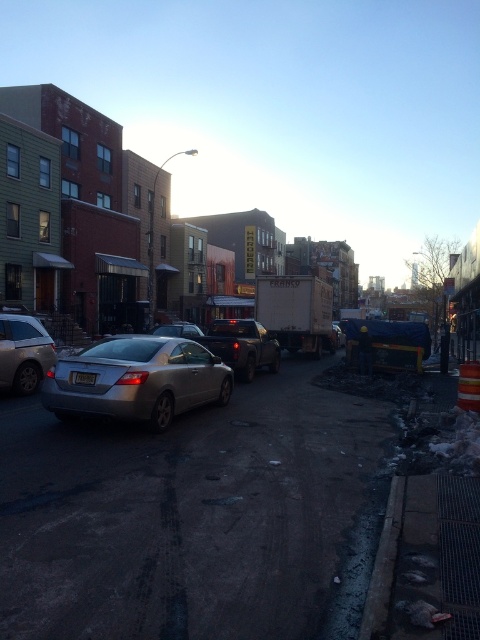
Question: Which object is closer to the camera taking this photo?

Choices:
 (A) satin silver sedan at center
 (B) silver metallic sedan at left
 (C) matte black truck at center

Answer: (A)

Question: Where is silver metallic sedan at left located in relation to matte black truck at center in the image?

Choices:
 (A) below
 (B) above

Answer: (A)

Question: Can you confirm if silver metallic sedan at left is positioned to the right of matte black truck at center?

Choices:
 (A) no
 (B) yes

Answer: (A)

Question: Which object is closer to the camera taking this photo?

Choices:
 (A) silver metallic sedan at left
 (B) satin silver sedan at center

Answer: (B)

Question: Is silver metallic sedan at left wider than matte black truck at center?

Choices:
 (A) yes
 (B) no

Answer: (B)

Question: Based on their relative distances, which object is farther from the matte black truck at center?

Choices:
 (A) satin silver sedan at center
 (B) silver metallic sedan at left

Answer: (A)